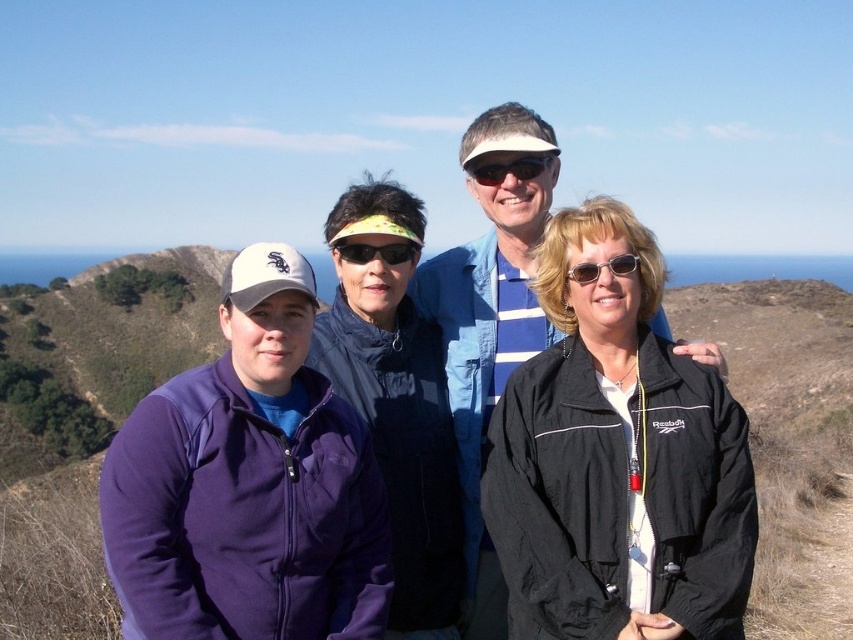
Between dark blue jacket at center and purple fleece jacket at center, which one appears on the left side from the viewer's perspective?

From the viewer's perspective, dark blue jacket at center appears more on the left side.

You are a GUI agent. You are given a task and a screenshot of the screen. Output one action in this format:
    pyautogui.click(x=<x>, y=<y>)
    Task: Click on the dark blue jacket at center
    
    Given the screenshot: What is the action you would take?
    pyautogui.click(x=397, y=404)

The height and width of the screenshot is (640, 853). What are the coordinates of `dark blue jacket at center` in the screenshot? It's located at (397, 404).

Between purple fleece jacket at center and black plastic sunglasses at center, which one is positioned lower?

Positioned lower is purple fleece jacket at center.

Is purple fleece jacket at center taller than black plastic sunglasses at center?

Yes.

The width and height of the screenshot is (853, 640). Describe the element at coordinates (489, 324) in the screenshot. I see `purple fleece jacket at center` at that location.

Where is `purple fleece jacket at center`? The image size is (853, 640). purple fleece jacket at center is located at coordinates (489, 324).

Describe the element at coordinates (489, 323) in the screenshot. I see `blue striped shirt at center` at that location.

This screenshot has width=853, height=640. In order to click on blue striped shirt at center in this screenshot , I will do `click(489, 323)`.

The image size is (853, 640). I want to click on blue striped shirt at center, so click(489, 323).